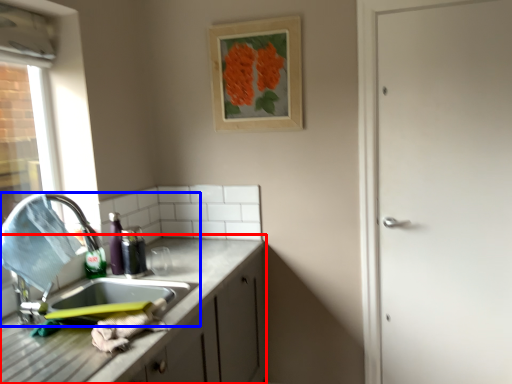
Question: Which of the following is the closest to the observer, cabinetry (highlighted by a red box) or sink (highlighted by a blue box)?

Choices:
 (A) cabinetry
 (B) sink

Answer: (A)